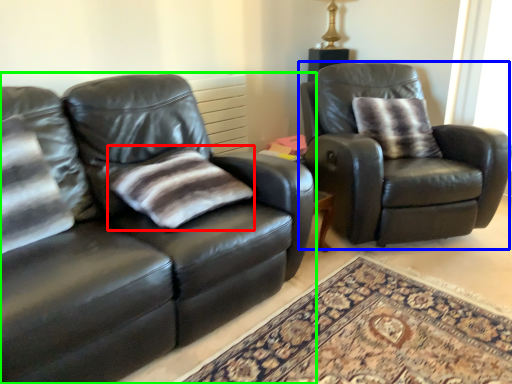
Question: Considering the real-world distances, which object is farthest from pillow (highlighted by a red box)? chair (highlighted by a blue box) or studio couch (highlighted by a green box)?

Choices:
 (A) chair
 (B) studio couch

Answer: (A)